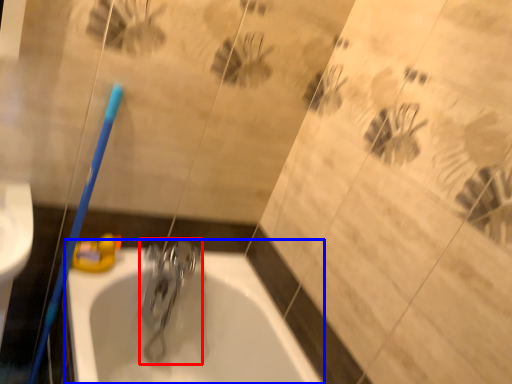
Question: Among these objects, which one is farthest to the camera, tap (highlighted by a red box) or bathtub (highlighted by a blue box)?

Choices:
 (A) tap
 (B) bathtub

Answer: (A)